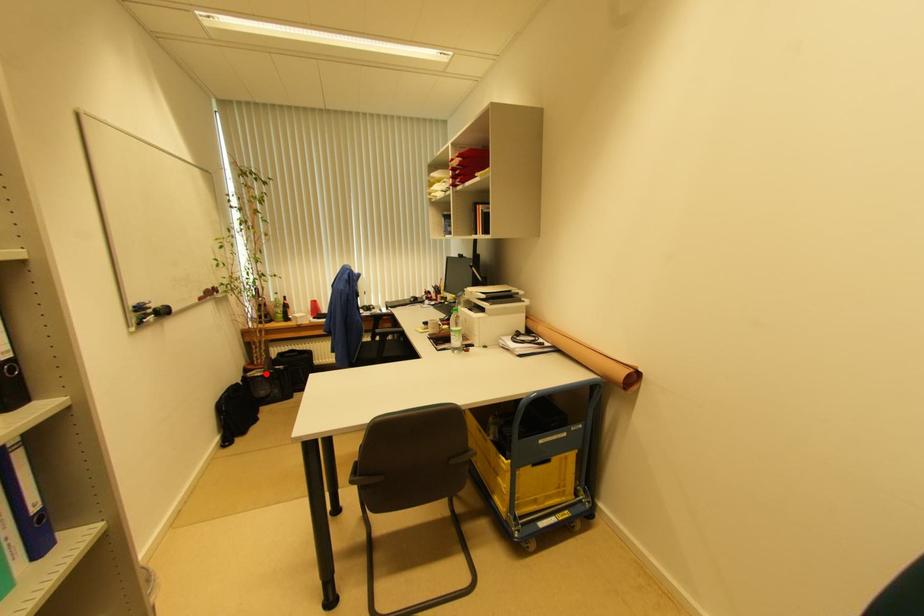
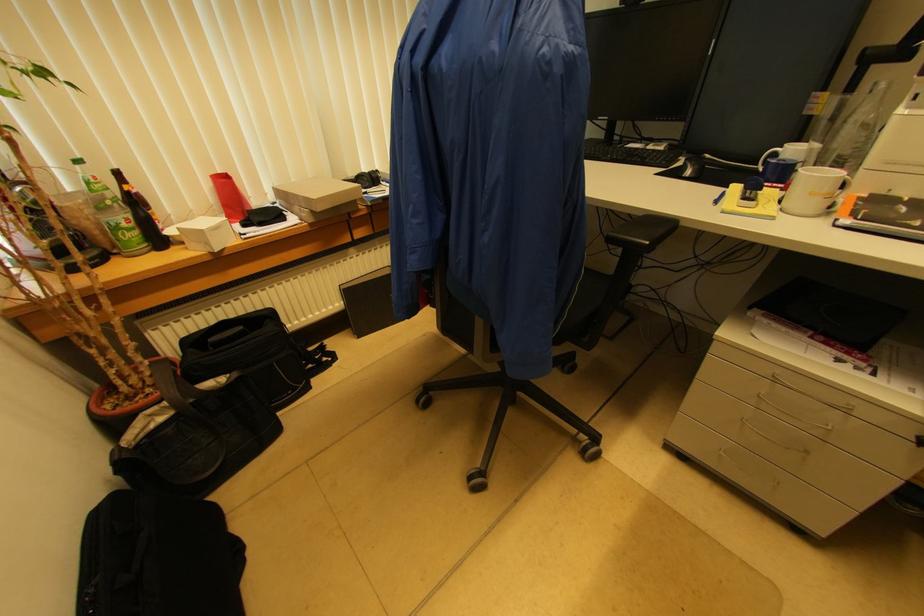
Where in the second image is the point corresponding to the highlighted location from the first image?

(175, 408)